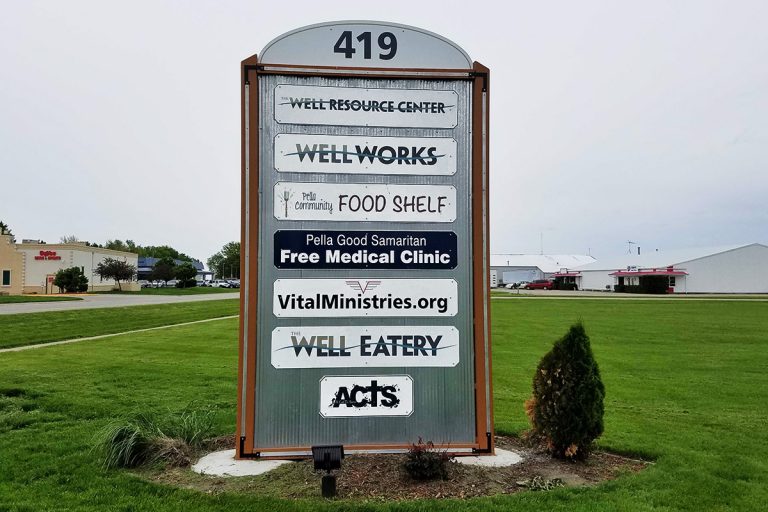
Image resolution: width=768 pixels, height=512 pixels. In order to click on food shelf sign in this screenshot , I will do `click(379, 202)`.